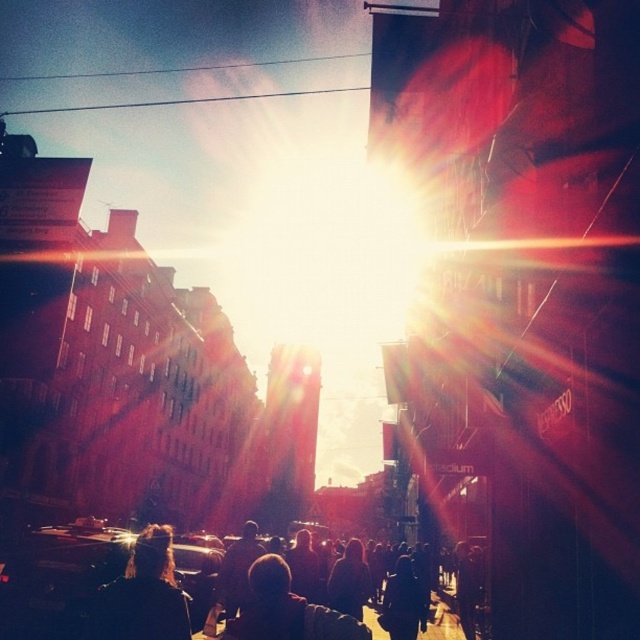
Question: Observing the image, what is the correct spatial positioning of dark hair at lower left in reference to dark hair at center?

Choices:
 (A) left
 (B) right

Answer: (A)

Question: In this image, where is dark hair at lower left located relative to dark hair at center?

Choices:
 (A) below
 (B) above

Answer: (A)

Question: Is dark hair at lower left positioned in front of dark hair at center?

Choices:
 (A) no
 (B) yes

Answer: (A)

Question: Which point is farther to the camera?

Choices:
 (A) (268, 554)
 (B) (106, 586)

Answer: (A)